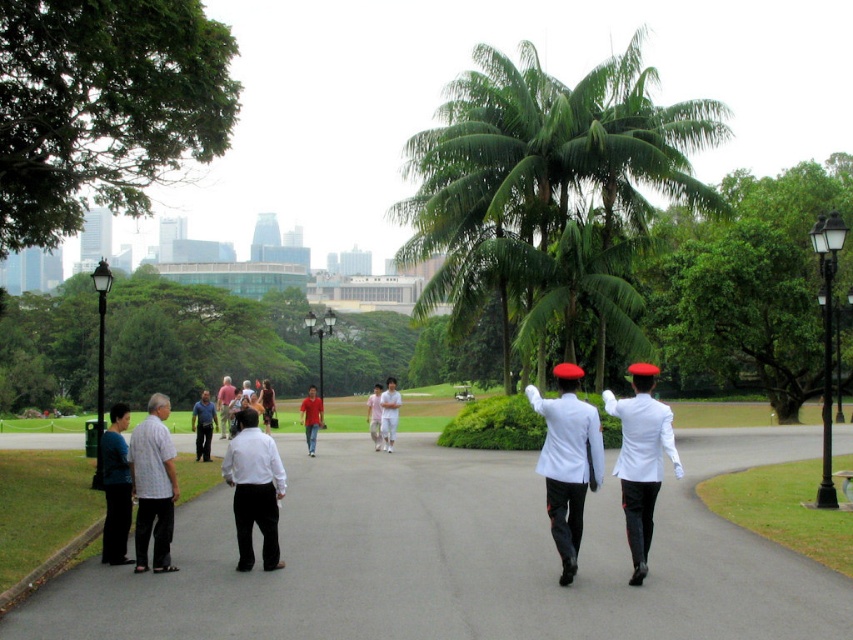
Question: Can you confirm if plaid shirt at left is smaller than matte white shirt at center?

Choices:
 (A) yes
 (B) no

Answer: (A)

Question: Which of the following is the closest to the observer?

Choices:
 (A) matte blue shirt at center
 (B) matte white shirt at center
 (C) white matte uniform at center
 (D) white matte shirt at center

Answer: (C)

Question: Among these objects, which one is farthest from the camera?

Choices:
 (A) matte blue shirt at center
 (B) white matte shirt at center
 (C) white cotton shirt at center
 (D) white matte uniform at center

Answer: (C)

Question: Is green leafy palm tree at center to the right of white matte jacket at center from the viewer's perspective?

Choices:
 (A) no
 (B) yes

Answer: (A)

Question: Which point is farther to the camera?

Choices:
 (A) (654, 180)
 (B) (625, 602)
 (C) (222, 436)

Answer: (C)

Question: Can you confirm if white matte uniform at center is positioned below matte red shirt at center?

Choices:
 (A) no
 (B) yes

Answer: (A)